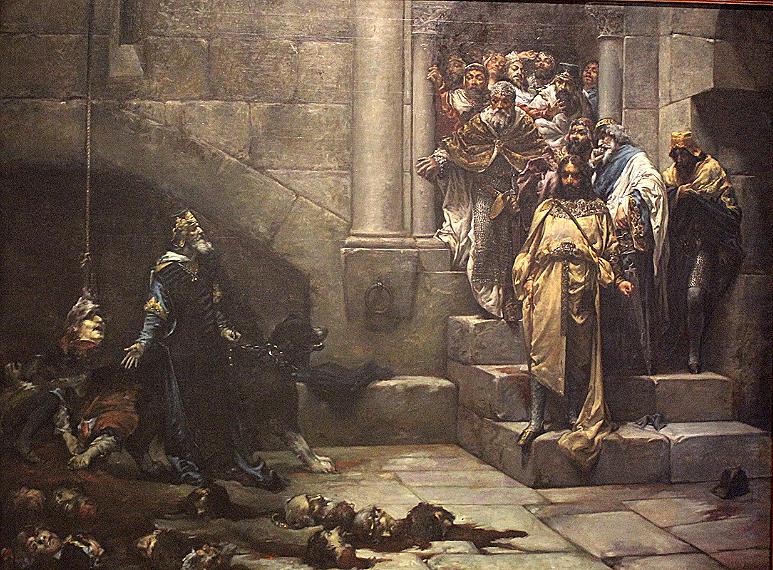
I want to click on stair, so click(x=516, y=425), click(x=499, y=370), click(x=468, y=320), click(x=460, y=274).